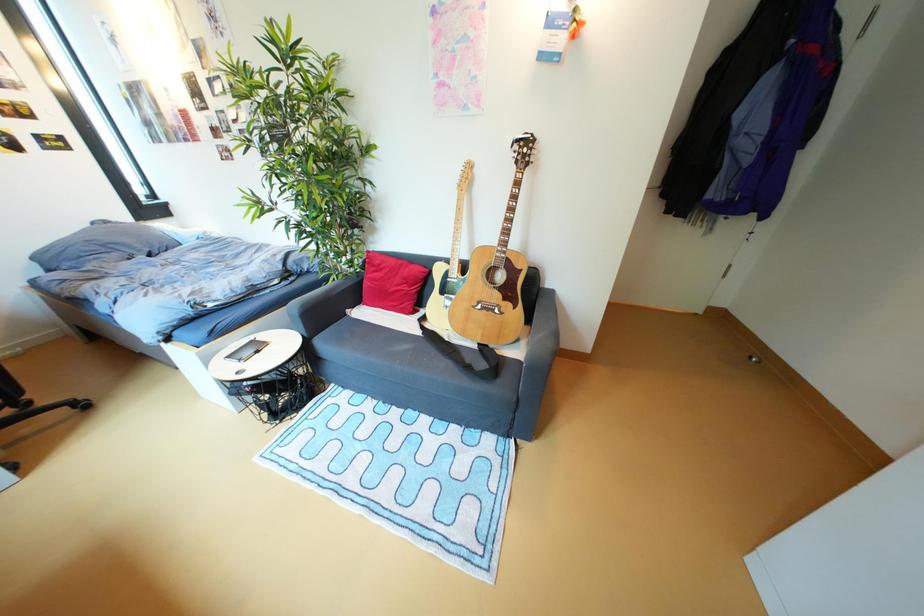
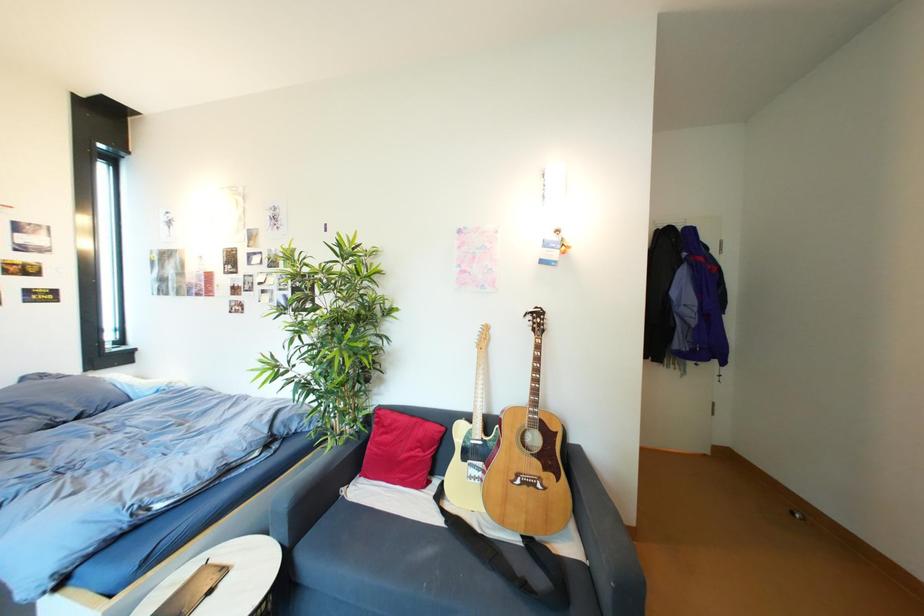
Question: Based on the continuous images, in which direction is the camera rotating? Reply with the corresponding letter.

Choices:
 (A) Left
 (B) Right
 (C) Up
 (D) Down

Answer: (C)